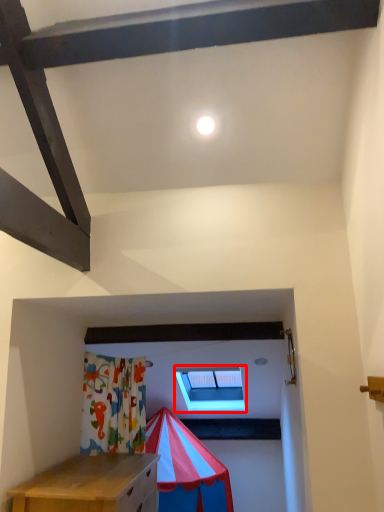
Question: From the image's perspective, what is the correct spatial positioning of window (annotated by the red box) in reference to light?

Choices:
 (A) above
 (B) below

Answer: (B)